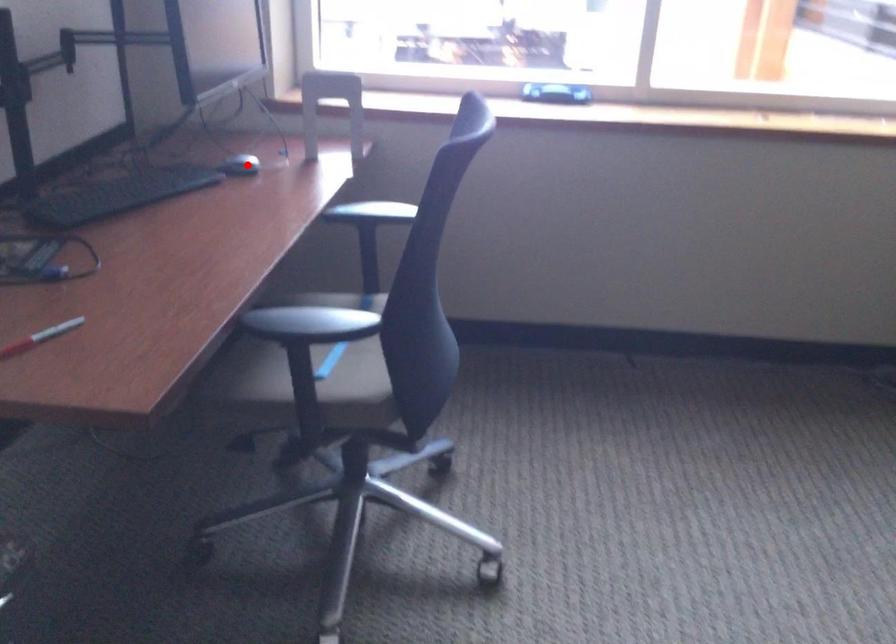
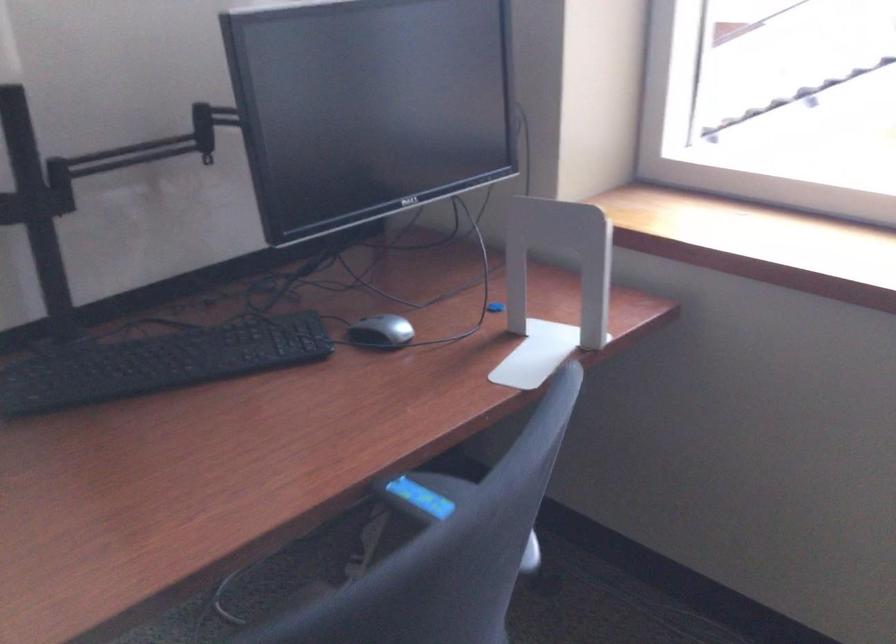
Find the pixel in the second image that matches the highlighted location in the first image.

(381, 332)